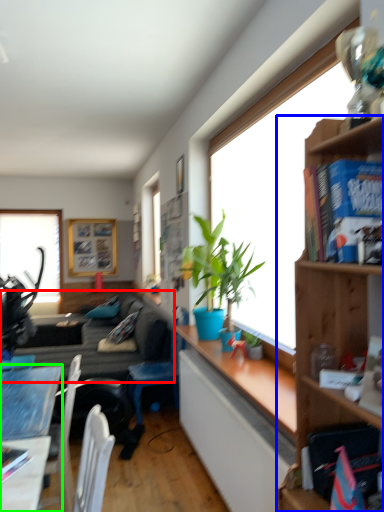
Question: Based on their relative distances, which object is nearer to studio couch (highlighted by a red box)? Choose from shelf (highlighted by a blue box) and desk (highlighted by a green box).

Choices:
 (A) shelf
 (B) desk

Answer: (B)